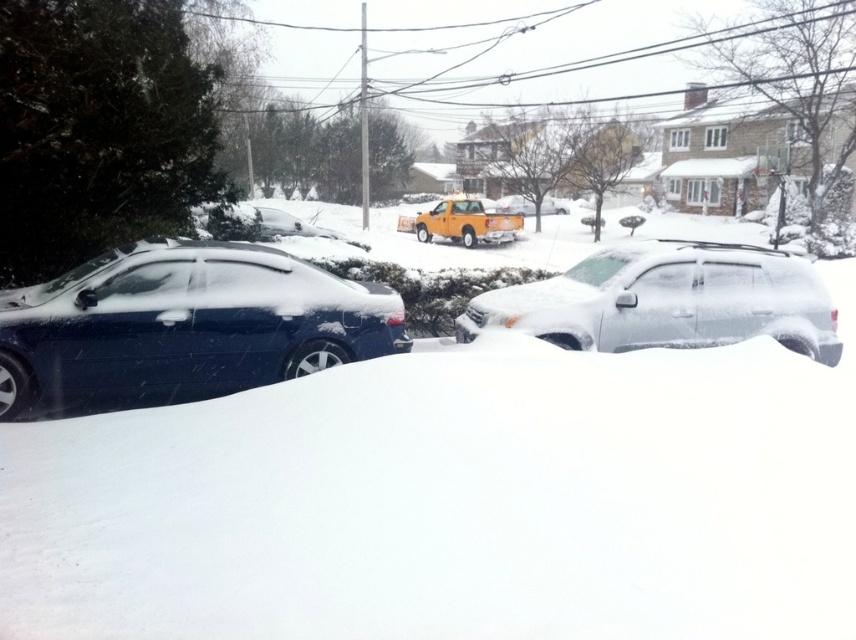
Question: Which point appears closest to the camera in this image?

Choices:
 (A) (605, 278)
 (B) (539, 396)
 (C) (383, 332)
 (D) (474, 237)

Answer: (B)

Question: Does glossy blue sedan at left appear over yellow matte truck at center?

Choices:
 (A) no
 (B) yes

Answer: (A)

Question: Among these objects, which one is farthest from the camera?

Choices:
 (A) sleek silver suv at center
 (B) glossy blue sedan at left
 (C) yellow matte truck at center

Answer: (C)

Question: Can you confirm if white fluffy snow at center is bigger than glossy blue sedan at left?

Choices:
 (A) yes
 (B) no

Answer: (A)

Question: In this image, where is glossy blue sedan at left located relative to yellow matte truck at center?

Choices:
 (A) below
 (B) above

Answer: (A)

Question: Which point is farther to the camera?

Choices:
 (A) (290, 282)
 (B) (461, 232)
 (C) (666, 314)

Answer: (B)